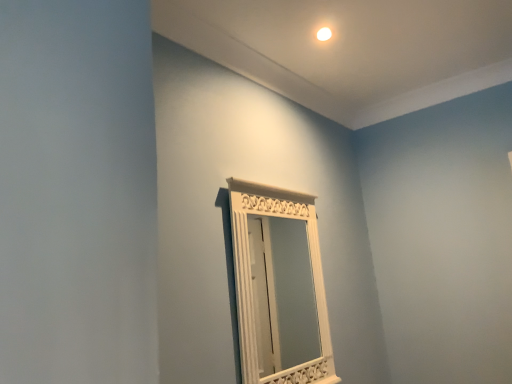
Where is `white glossy light fixture at upper center`? white glossy light fixture at upper center is located at coordinates (324, 34).

The height and width of the screenshot is (384, 512). What do you see at coordinates (324, 34) in the screenshot?
I see `white glossy light fixture at upper center` at bounding box center [324, 34].

At what (x,y) coordinates should I click in order to perform the action: click on white glossy light fixture at upper center. Please return your answer as a coordinate pair (x, y). This screenshot has height=384, width=512. Looking at the image, I should click on (324, 34).